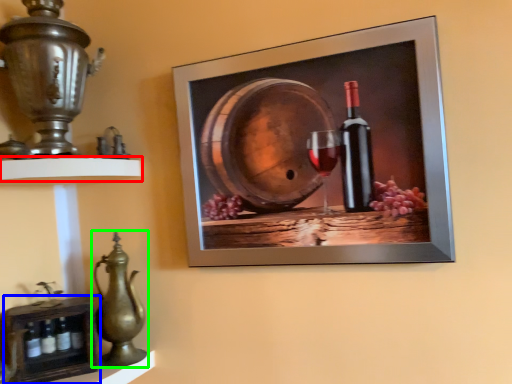
Question: Estimate the real-world distances between objects in this image. Which object is farther from shelf (highlighted by a red box), shelf (highlighted by a blue box) or jug (highlighted by a green box)?

Choices:
 (A) shelf
 (B) jug

Answer: (A)